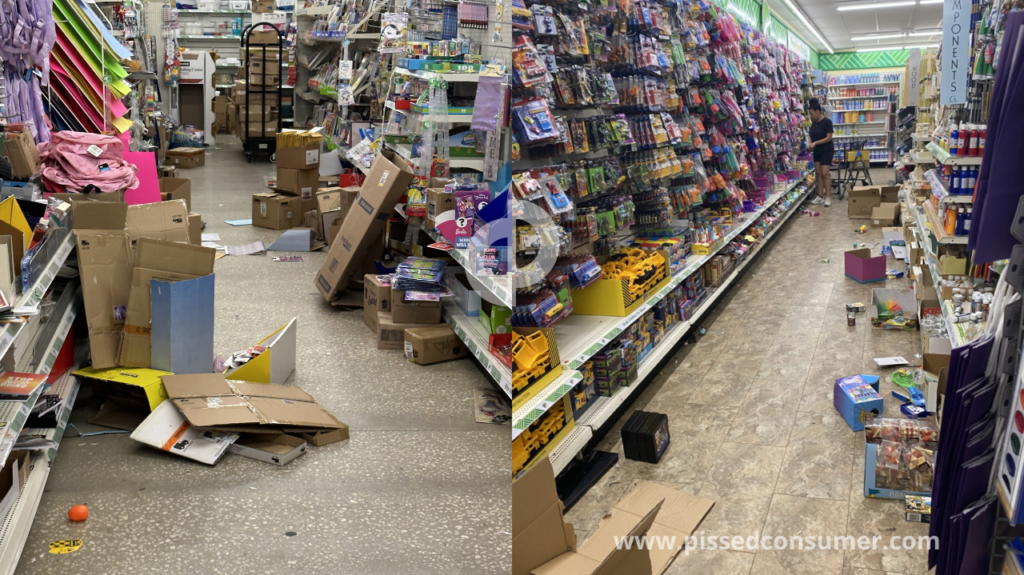
Find the location of a particular element. This screenshot has width=1024, height=575. back shelving unit is located at coordinates (877, 126).